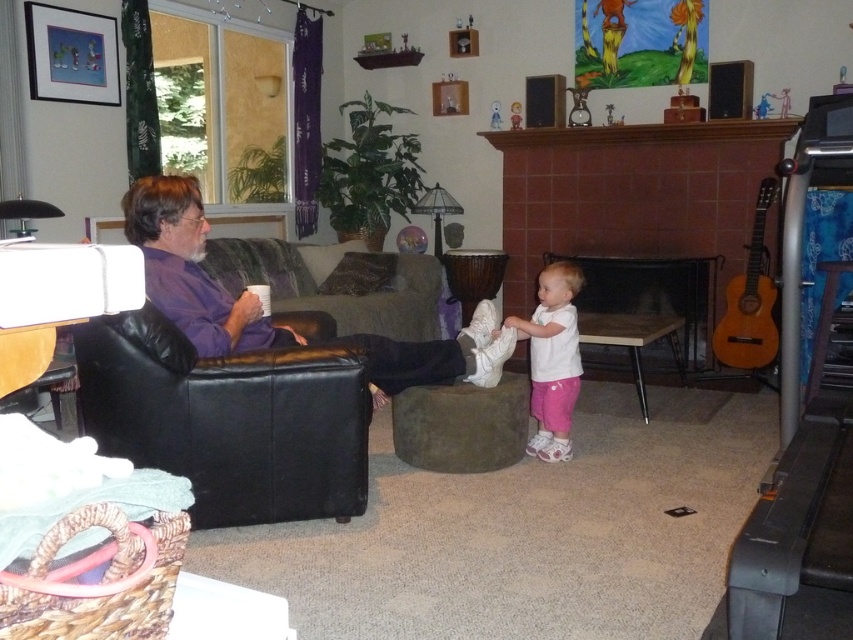
Does black leather bean bag chair at left have a lesser height compared to white matte shirt at center?

Yes.

Who is taller, black leather bean bag chair at left or white matte shirt at center?

Standing taller between the two is white matte shirt at center.

Describe the element at coordinates (228, 419) in the screenshot. I see `black leather bean bag chair at left` at that location.

This screenshot has height=640, width=853. I want to click on black leather bean bag chair at left, so click(x=228, y=419).

Between point (146, 435) and point (556, 246), which one is positioned in front?

Point (146, 435) is more forward.

Does black leather bean bag chair at left have a smaller size compared to brown tile fireplace at center?

Correct, black leather bean bag chair at left occupies less space than brown tile fireplace at center.

Where is `black leather bean bag chair at left`? This screenshot has height=640, width=853. black leather bean bag chair at left is located at coordinates (228, 419).

The width and height of the screenshot is (853, 640). I want to click on black leather bean bag chair at left, so click(x=228, y=419).

Between point (599, 362) and point (683, 323), which one is positioned behind?

Point (599, 362)

Is brown tile fireplace at center above black metal fireplace at center?

Correct, brown tile fireplace at center is located above black metal fireplace at center.

Is point (515, 252) positioned before point (694, 296)?

No, (515, 252) is behind (694, 296).

Identify the location of brown tile fireplace at center. (634, 198).